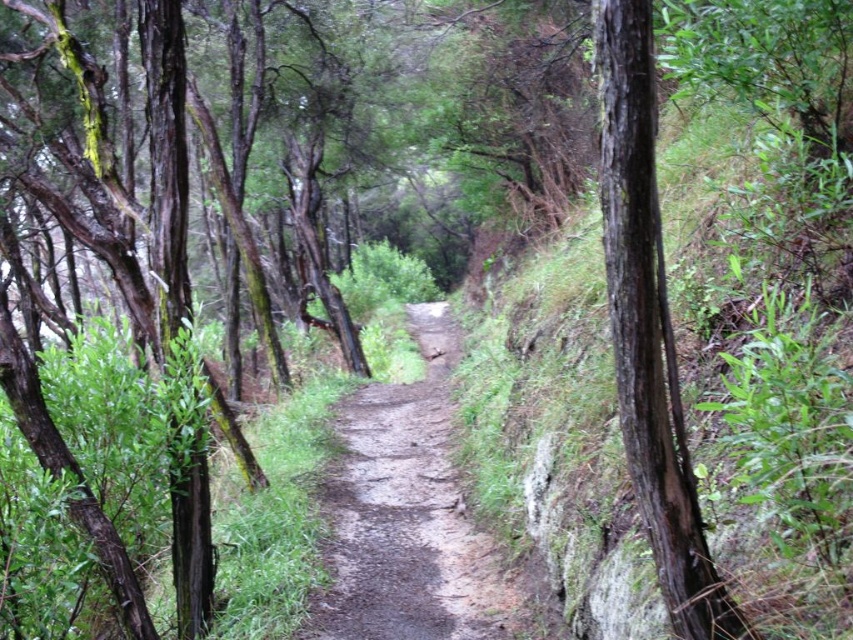
Question: Is damp dirt path at center to the left of dark brown bark tree at right from the viewer's perspective?

Choices:
 (A) yes
 (B) no

Answer: (A)

Question: Observing the image, what is the correct spatial positioning of damp dirt path at center in reference to dark brown bark tree at right?

Choices:
 (A) right
 (B) left

Answer: (B)

Question: Among these objects, which one is nearest to the camera?

Choices:
 (A) damp dirt path at center
 (B) dark brown bark tree at right

Answer: (B)

Question: Is damp dirt path at center wider than dark brown bark tree at right?

Choices:
 (A) yes
 (B) no

Answer: (A)